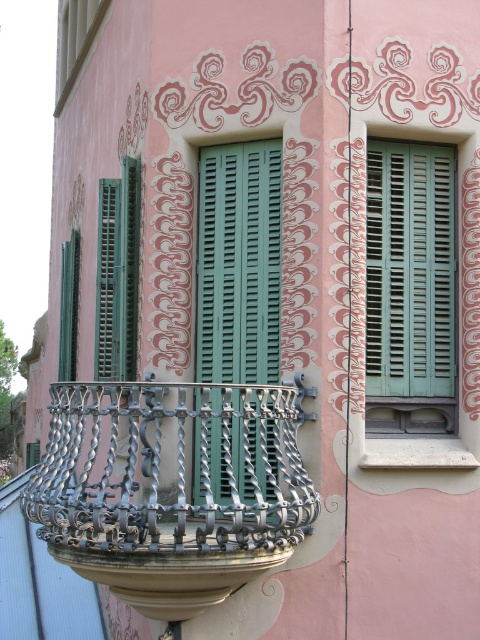
What object is located at the coordinates point [239,262] in the image?

The point [239,262] marks green matte shutters at center.

You are an architect inspecting the building facade. You notice two types of shutters on the windows. Which of the two shutters, the green matte shutters at center or the teal wooden shutters at center, is located below the other?

The green matte shutters at center is positioned under teal wooden shutters at center, meaning the green matte shutters at center are below the teal wooden shutters at center.

You are an architect designing a new building inspired by the image. You need to ensure that the green matte shutters at center and teal wooden shutters at center will fit within the allocated space. Which of the two shutters is narrower?

The green matte shutters at center is narrower than the teal wooden shutters at center, so it will fit better in a narrower space.